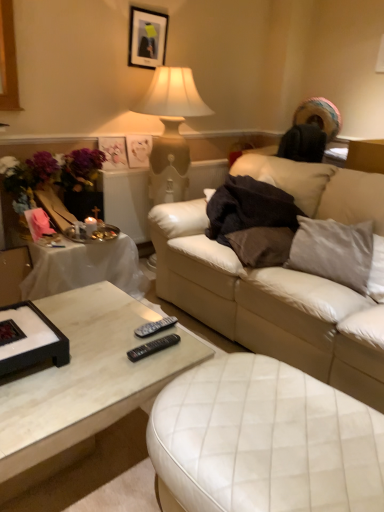
At what (x,y) coordinates should I click in order to perform the action: click on black plastic remote at lower center, which is counted as the 1th remote, starting from the front. Please return your answer as a coordinate pair (x, y). Looking at the image, I should click on [x=152, y=347].

Describe the element at coordinates (84, 268) in the screenshot. The width and height of the screenshot is (384, 512). I see `white marble coffee table at lower left` at that location.

What do you see at coordinates (147, 38) in the screenshot? I see `matte black picture frame at upper center, which ranks as the 3th picture frame in bottom-to-top order` at bounding box center [147, 38].

The height and width of the screenshot is (512, 384). I want to click on black plastic remote at lower center, the second remote in the back-to-front sequence, so click(152, 347).

Is white marble coffee table at lower left oriented away from satin gray pillow at right?

white marble coffee table at lower left is not turned away from satin gray pillow at right.

From a real-world perspective, which object stands above the other?

satin gray pillow at right, from a real-world perspective.

How far apart are white marble coffee table at lower left and satin gray pillow at right?

white marble coffee table at lower left and satin gray pillow at right are 1.30 meters apart from each other.

In order to click on pillow on the right of white marble coffee table at lower left in this screenshot , I will do `click(339, 254)`.

Measure the distance from leather couch at center to matte white picture frame at upper center, the 2th picture frame when ordered from top to bottom.

1.36 meters.

From the picture: How different are the orientations of leather couch at center and matte white picture frame at upper center, the 2th picture frame when ordered from top to bottom, in degrees?

The facing directions of leather couch at center and matte white picture frame at upper center, the 2th picture frame when ordered from top to bottom, are 89.6 degrees apart.

Could matte white picture frame at upper center, the second picture frame in the bottom-to-top sequence, be considered to be inside leather couch at center?

No, matte white picture frame at upper center, the second picture frame in the bottom-to-top sequence, is located outside of leather couch at center.

Looking at this image, between leather couch at center and matte white picture frame at upper center, the second picture frame in the bottom-to-top sequence, which one has larger width?

leather couch at center is wider.

How much distance is there between matte white picture frame at upper center, the second picture frame in the bottom-to-top sequence, and vibrant silk bouquet at left?

They are 23.46 inches apart.

Considering the relative sizes of matte white picture frame at upper center, the second picture frame in the bottom-to-top sequence, and vibrant silk bouquet at left in the image provided, is matte white picture frame at upper center, the second picture frame in the bottom-to-top sequence, shorter than vibrant silk bouquet at left?

Yes.

This screenshot has height=512, width=384. Identify the location of the 3rd picture frame behind when counting from the vibrant silk bouquet at left. (138, 150).

How different are the orientations of matte white picture frame at upper center, the 2th picture frame when ordered from top to bottom, and vibrant silk bouquet at left in degrees?

The facing directions of matte white picture frame at upper center, the 2th picture frame when ordered from top to bottom, and vibrant silk bouquet at left are 1.24 degrees apart.

Locate an element on the screen. Image resolution: width=384 pixels, height=512 pixels. the 1st picture frame directly beneath the matte black picture frame at upper center, positioned as the first picture frame in top-to-bottom order (from a real-world perspective) is located at coordinates (138, 150).

How distant is matte white picture frame at upper center, the 2th picture frame when ordered from top to bottom, from matte black picture frame at upper center, positioned as the first picture frame in top-to-bottom order?

matte white picture frame at upper center, the 2th picture frame when ordered from top to bottom, and matte black picture frame at upper center, positioned as the first picture frame in top-to-bottom order, are 25.79 inches apart from each other.

Can we say matte white picture frame at upper center, the 2th picture frame when ordered from top to bottom, lies outside matte black picture frame at upper center, positioned as the first picture frame in top-to-bottom order?

That's correct, matte white picture frame at upper center, the 2th picture frame when ordered from top to bottom, is outside of matte black picture frame at upper center, positioned as the first picture frame in top-to-bottom order.

Is matte white picture frame at upper center, the second picture frame in the bottom-to-top sequence, to the right of matte black picture frame at upper center, which ranks as the 3th picture frame in bottom-to-top order, from the viewer's perspective?

Incorrect, matte white picture frame at upper center, the second picture frame in the bottom-to-top sequence, is not on the right side of matte black picture frame at upper center, which ranks as the 3th picture frame in bottom-to-top order.

From the picture: Is black plastic remote at lower center, the second remote in the back-to-front sequence, thinner than leather couch at center?

Correct, the width of black plastic remote at lower center, the second remote in the back-to-front sequence, is less than that of leather couch at center.

Image resolution: width=384 pixels, height=512 pixels. I want to click on studio couch on the right of black plastic remote at lower center, which is counted as the 1th remote, starting from the front, so point(270,305).

Are black plastic remote at lower center, the second remote in the back-to-front sequence, and leather couch at center far apart?

They are positioned close to each other.

Is black plastic remote at lower center, which is counted as the 1th remote, starting from the front, not inside leather couch at center?

Yes.

Could you tell me if white marble coffee table at lower left is facing white marble coffee table at lower left?

No, white marble coffee table at lower left is not facing towards white marble coffee table at lower left.

Is point (85, 325) positioned before point (78, 253)?

Yes, point (85, 325) is in front of point (78, 253).

From a real-world perspective, who is located higher, white marble coffee table at lower left or white marble coffee table at lower left?

white marble coffee table at lower left, from a real-world perspective.

Is satin gray pillow at right far away from white marble coffee table at lower left?

Yes.

Between point (320, 238) and point (72, 410), which one is positioned behind?

Positioned behind is point (320, 238).

In terms of size, does satin gray pillow at right appear bigger or smaller than white marble coffee table at lower left?

In the image, satin gray pillow at right appears to be smaller than white marble coffee table at lower left.

How different are the orientations of satin gray pillow at right and white marble coffee table at lower left in degrees?

The angle between the facing direction of satin gray pillow at right and the facing direction of white marble coffee table at lower left is 64.2 degrees.

Where is `cocktail table to the left of satin gray pillow at right`? The height and width of the screenshot is (512, 384). cocktail table to the left of satin gray pillow at right is located at coordinates (84, 268).

Identify the location of studio couch on the right of matte white picture frame at upper center, the 2th picture frame when ordered from top to bottom. Image resolution: width=384 pixels, height=512 pixels. (270, 305).

Looking at the image, which one is located further to satin gray pillow at right, matte black picture frame at upper center, positioned as the first picture frame in top-to-bottom order, or white leather ottoman at center?

The object further to satin gray pillow at right is matte black picture frame at upper center, positioned as the first picture frame in top-to-bottom order.

Which object lies nearer to the anchor point matte black picture frame at upper center, which ranks as the 3th picture frame in bottom-to-top order, leather couch at center or black plastic remote at lower center, which is counted as the 1th remote, starting from the front?

leather couch at center is closer to matte black picture frame at upper center, which ranks as the 3th picture frame in bottom-to-top order.

When comparing their distances from satin gray pillow at right, does matte black picture frame at upper center, positioned as the first picture frame in top-to-bottom order, or matte white picture frame at upper center, the second picture frame in the bottom-to-top sequence, seem further?

Among the two, matte black picture frame at upper center, positioned as the first picture frame in top-to-bottom order, is located further to satin gray pillow at right.

Considering their positions, is white marble coffee table at lower left positioned further to white leather ottoman at center than matte black picture frame at upper center, which ranks as the 3th picture frame in bottom-to-top order?

matte black picture frame at upper center, which ranks as the 3th picture frame in bottom-to-top order.

From the image, which object appears to be nearer to black plastic remote at center, which is counted as the first remote, starting from the back, black plastic remote at lower center, which is counted as the 1th remote, starting from the front, or white leather ottoman at center?

The object closer to black plastic remote at center, which is counted as the first remote, starting from the back, is black plastic remote at lower center, which is counted as the 1th remote, starting from the front.

Based on their spatial positions, is leather couch at center or matte black picture frame at upper center, which ranks as the 3th picture frame in bottom-to-top order, closer to vibrant silk bouquet at left?

Based on the image, matte black picture frame at upper center, which ranks as the 3th picture frame in bottom-to-top order, appears to be nearer to vibrant silk bouquet at left.

Which object lies further to the anchor point black plastic remote at lower center, the second remote in the back-to-front sequence, white leather ottoman at center or vibrant silk bouquet at left?

vibrant silk bouquet at left is positioned further to the anchor black plastic remote at lower center, the second remote in the back-to-front sequence.

From the image, which object appears to be nearer to matte black picture frame at upper center, positioned as the first picture frame in top-to-bottom order, satin gray pillow at right or white marble coffee table at lower left?

white marble coffee table at lower left lies closer to matte black picture frame at upper center, positioned as the first picture frame in top-to-bottom order, than the other object.

Locate an element on the screen. This screenshot has width=384, height=512. cocktail table between white leather ottoman at center and matte white picture frame at upper center, the 2th picture frame when ordered from top to bottom, along the z-axis is located at coordinates (x=84, y=268).

The height and width of the screenshot is (512, 384). I want to click on pillow between white marble coffee table at lower left and matte white picture frame at upper center, the second picture frame in the bottom-to-top sequence, from front to back, so click(339, 254).

Locate an element on the screen. This screenshot has width=384, height=512. swivel chair between vibrant silk bouquet at left and satin gray pillow at right is located at coordinates (263, 441).

Find the location of `cocktail table between white leather ottoman at center and vibrant silk bouquet at left from front to back`. cocktail table between white leather ottoman at center and vibrant silk bouquet at left from front to back is located at coordinates (84, 268).